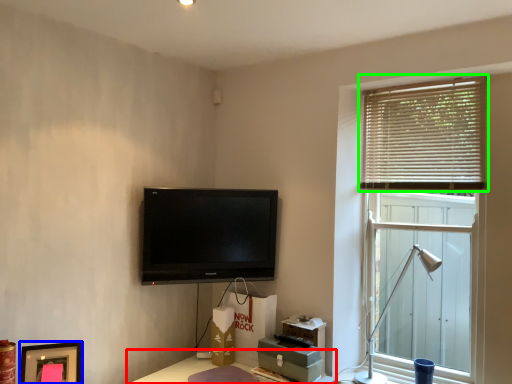
Question: Based on their relative distances, which object is nearer to table (highlighted by a red box)? Choose from picture frame (highlighted by a blue box) and window blind (highlighted by a green box).

Choices:
 (A) picture frame
 (B) window blind

Answer: (A)